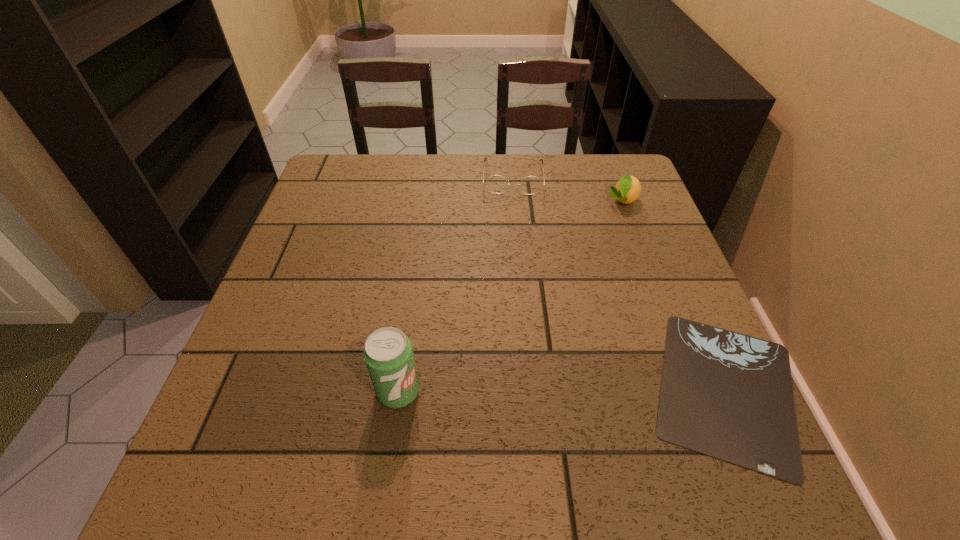
Where is `object positioned at the far right corner`? Image resolution: width=960 pixels, height=540 pixels. object positioned at the far right corner is located at coordinates (627, 190).

At what (x,y) coordinates should I click in order to perform the action: click on object located at the near right corner. Please return your answer as a coordinate pair (x, y). Looking at the image, I should click on (727, 395).

Identify the location of free space at the far edge. (474, 184).

In the image, there is a desktop. What are the coordinates of `vacant area at the near edge` in the screenshot? It's located at (622, 389).

Find the location of a particular element. The image size is (960, 540). vacant region at the left edge of the desktop is located at coordinates 296,235.

Identify the location of vacant space at the right edge. (622, 298).

Identify the location of vacant space at the far left corner of the desktop. (349, 171).

In order to click on vacant area at the far right corner of the desktop in this screenshot , I will do `click(608, 166)`.

In order to click on free point between the spectacles and the third shortest object in this screenshot , I will do `click(567, 190)`.

The width and height of the screenshot is (960, 540). What are the coordinates of `empty space between the third object from right to left and the mousepad` in the screenshot? It's located at (619, 284).